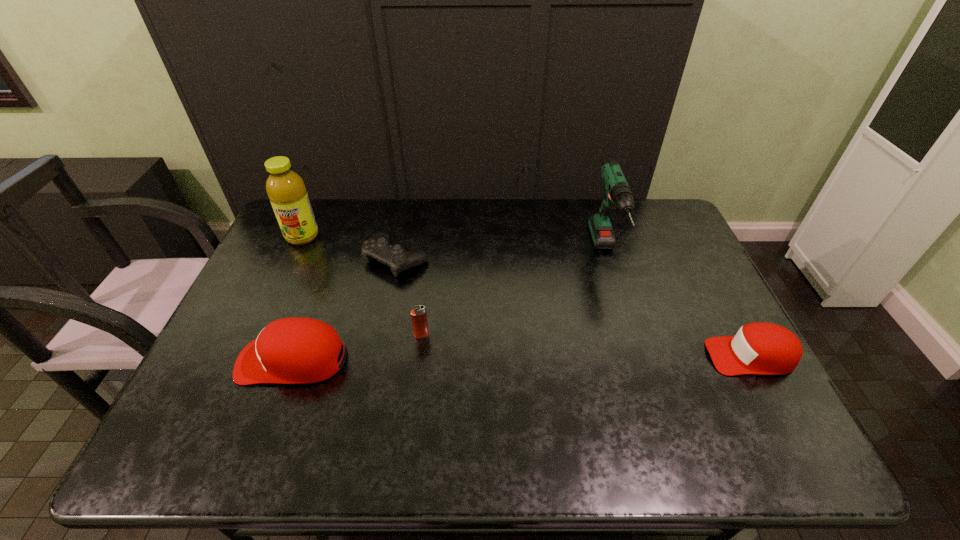
Find the location of `free point that satisfies the following two spatial constraints: 1. on the front side of the igniter; 2. on the right side of the control`. free point that satisfies the following two spatial constraints: 1. on the front side of the igniter; 2. on the right side of the control is located at coordinates (381, 335).

The width and height of the screenshot is (960, 540). In order to click on vacant space that satisfies the following two spatial constraints: 1. on the front side of the control; 2. on the front-facing side of the left baseball cap in this screenshot , I will do `click(375, 360)`.